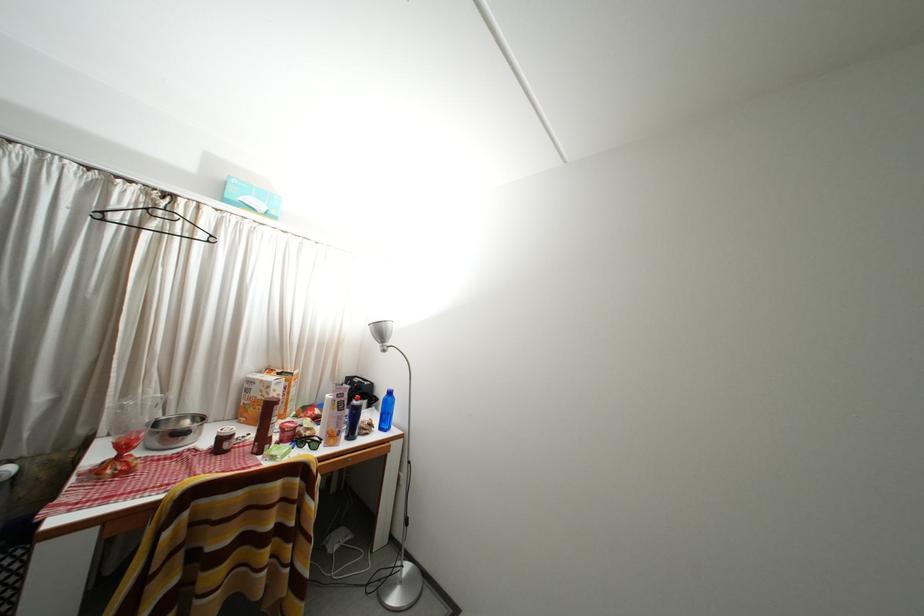
Image resolution: width=924 pixels, height=616 pixels. What are the coordinates of `red bottle cap` in the screenshot? It's located at (286, 431).